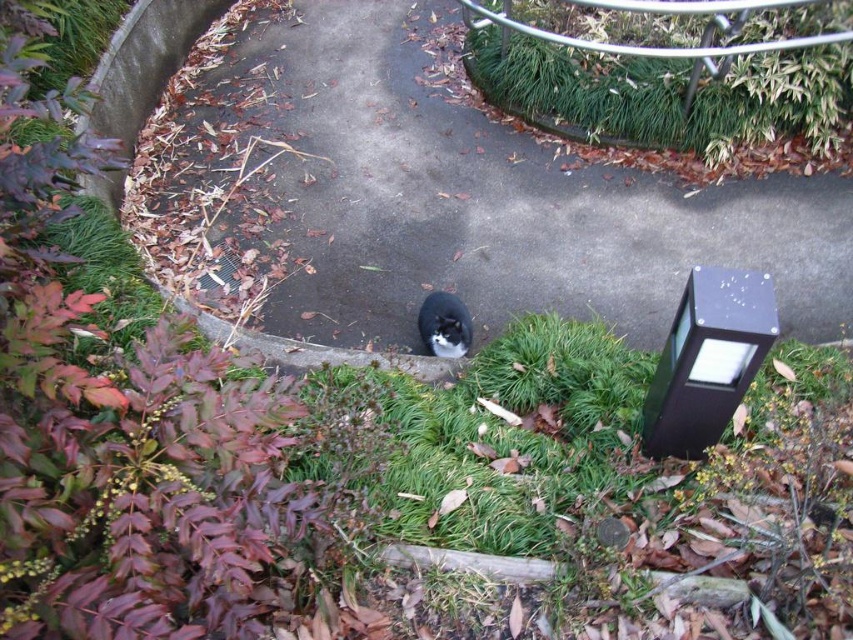
Between leaves at lower left and green grass at upper center, which one has more height?

leaves at lower left

Which is in front, point (68, 419) or point (676, 90)?

Point (68, 419) is more forward.

Who is more distant from viewer, (144,360) or (790,77)?

Point (790,77)

Locate an element on the screen. leaves at lower left is located at coordinates (119, 444).

Does point (262, 483) come in front of point (433, 352)?

Yes, point (262, 483) is closer to viewer.

Can you confirm if leaves at lower left is shorter than black fur cat at center?

No, leaves at lower left is not shorter than black fur cat at center.

The width and height of the screenshot is (853, 640). What do you see at coordinates (119, 444) in the screenshot?
I see `leaves at lower left` at bounding box center [119, 444].

Find the location of a particular element. Image resolution: width=853 pixels, height=640 pixels. leaves at lower left is located at coordinates (119, 444).

Can you confirm if green grass at upper center is shorter than black fur cat at center?

No, green grass at upper center is not shorter than black fur cat at center.

Can you confirm if green grass at upper center is smaller than black fur cat at center?

No.

Between point (708, 108) and point (451, 301), which one is positioned in front?

Positioned in front is point (451, 301).

The width and height of the screenshot is (853, 640). Find the location of `green grass at upper center`. green grass at upper center is located at coordinates click(x=668, y=74).